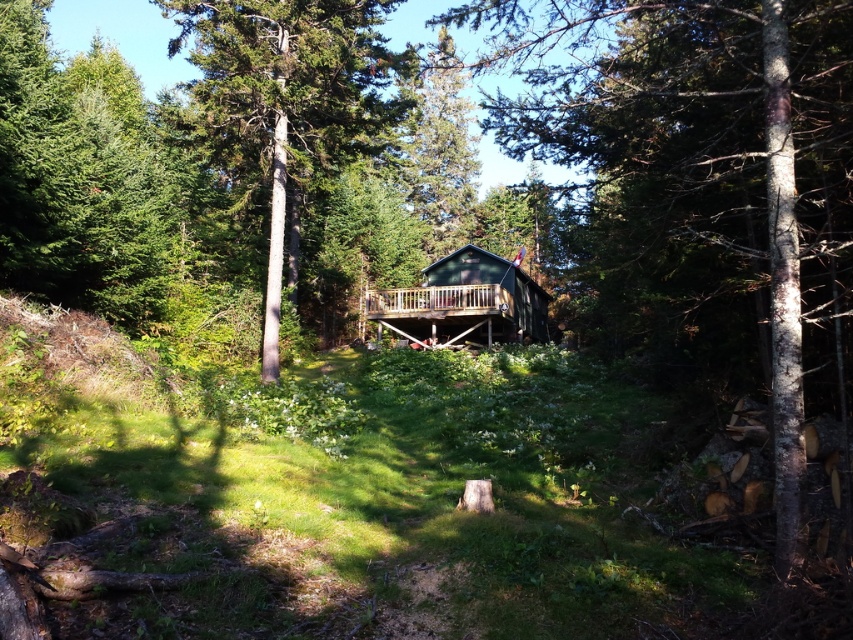
From the picture: You are standing in front of the cabin and want to determine which cabin is higher. You see the green wood cabin at center and the green matte cabin at center. Which one is positioned higher?

The green wood cabin at center is positioned higher than the green matte cabin at center.

Based on the photo, you are standing in front of the green matte cabin at center and want to walk towards the smooth gray tree trunk at center. Which direction should you move relative to the cabin?

You should move towards the smooth gray tree trunk at center, which is in front of the green matte cabin at center, so you should walk forward towards it.